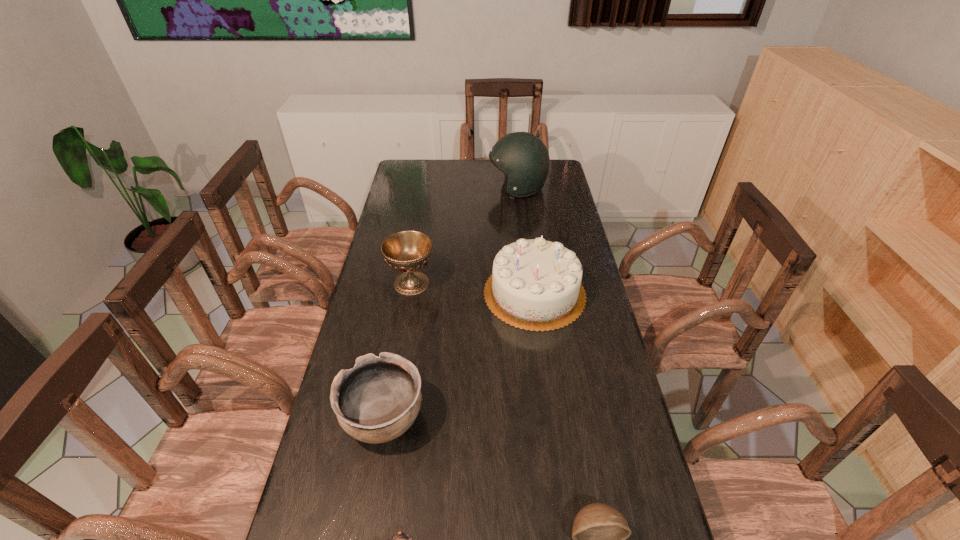
Where is `the tallest object`? This screenshot has height=540, width=960. the tallest object is located at coordinates (523, 157).

Identify the location of the farthest object. This screenshot has width=960, height=540. (523, 157).

Locate an element on the screen. This screenshot has height=540, width=960. birthday cake is located at coordinates (535, 285).

The width and height of the screenshot is (960, 540). Find the location of `chalice`. chalice is located at coordinates (407, 251).

You are a GUI agent. You are given a task and a screenshot of the screen. Output one action in this format:
    pyautogui.click(x=<x>, y=<y>)
    Task: Click on the pottery
    Image resolution: width=960 pixels, height=540 pixels.
    Given the screenshot: What is the action you would take?
    pyautogui.click(x=376, y=401)

Find the location of `free space located 0.190m at the face opening of the tallest object`. free space located 0.190m at the face opening of the tallest object is located at coordinates (445, 188).

Where is `free space located at the face opening of the tallest object`? Image resolution: width=960 pixels, height=540 pixels. free space located at the face opening of the tallest object is located at coordinates (470, 188).

The image size is (960, 540). I want to click on blank area located 0.270m at the face opening of the tallest object, so click(x=427, y=188).

Identify the location of vacant space located on the left of the birthday cake. This screenshot has width=960, height=540. (402, 293).

This screenshot has width=960, height=540. Identify the location of vacant space located on the front of the chalice. (394, 389).